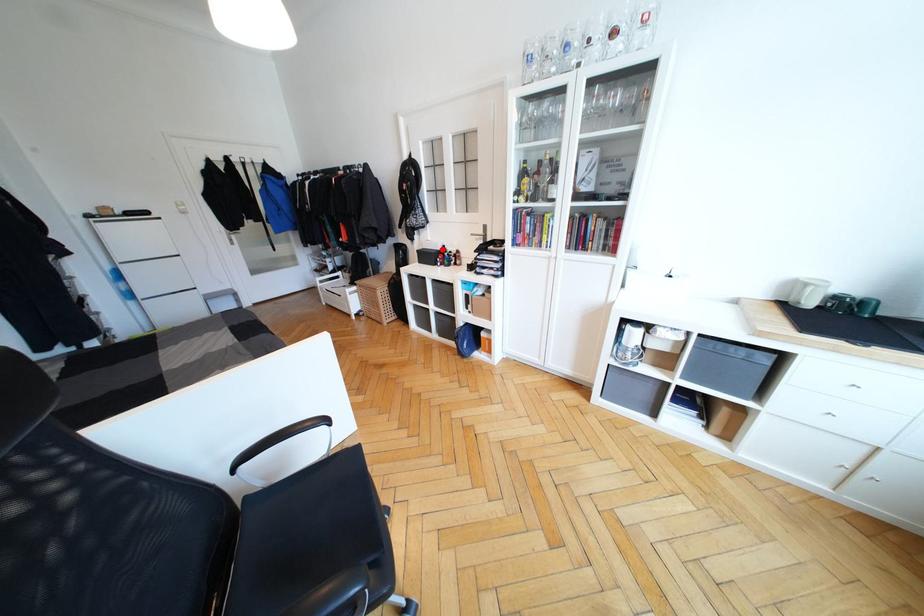
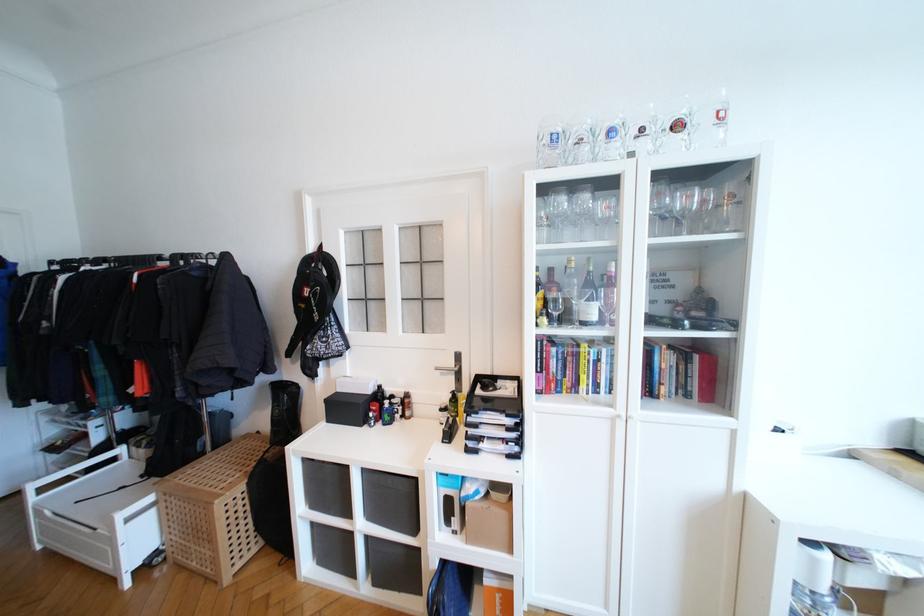
The point at the highlighted location is marked in the first image. Where is the corresponding point in the second image?

(372, 392)